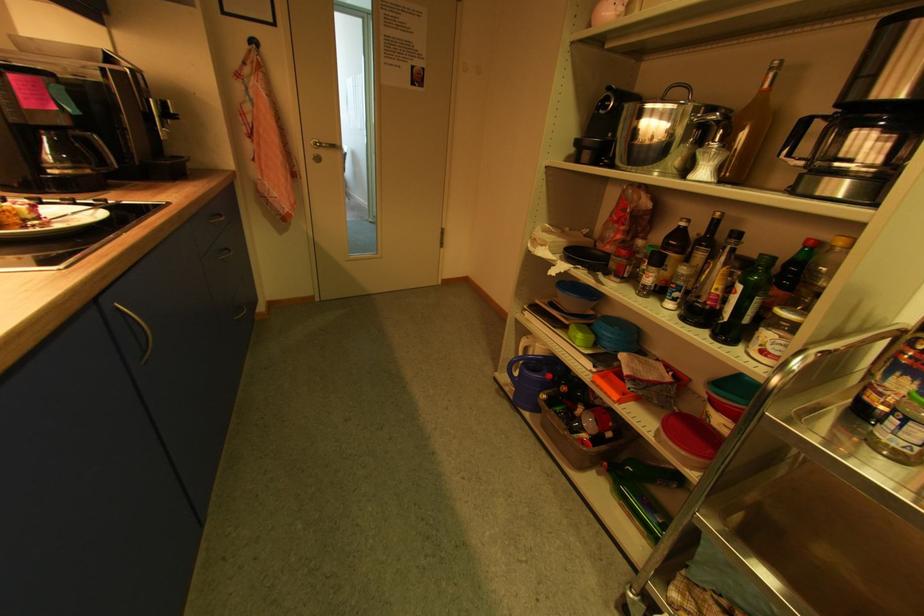
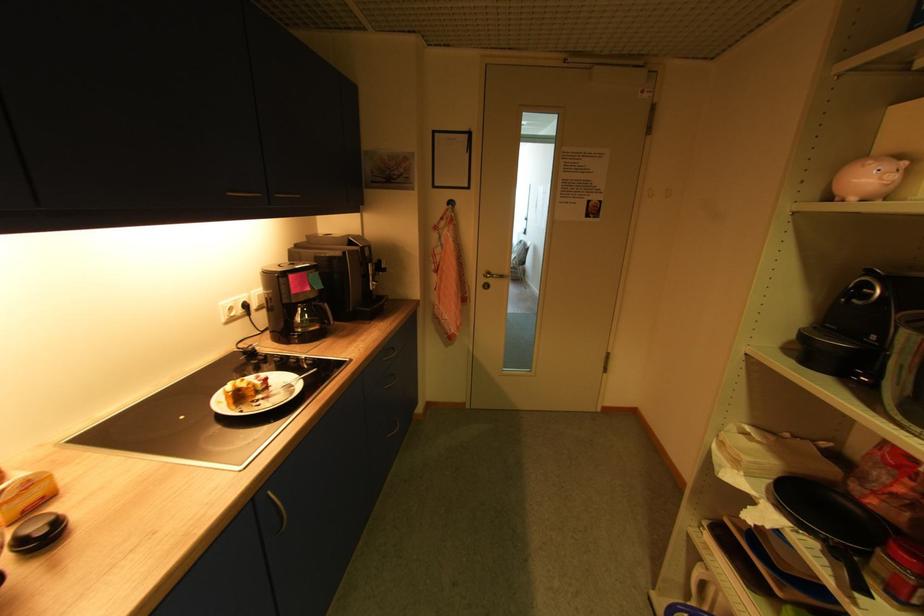
Question: The camera is either moving clockwise (left) or counter-clockwise (right) around the object. The first image is from the beginning of the video and the second image is from the end. Is the camera moving left or right when shooting the video?

Choices:
 (A) Left
 (B) Right

Answer: (B)